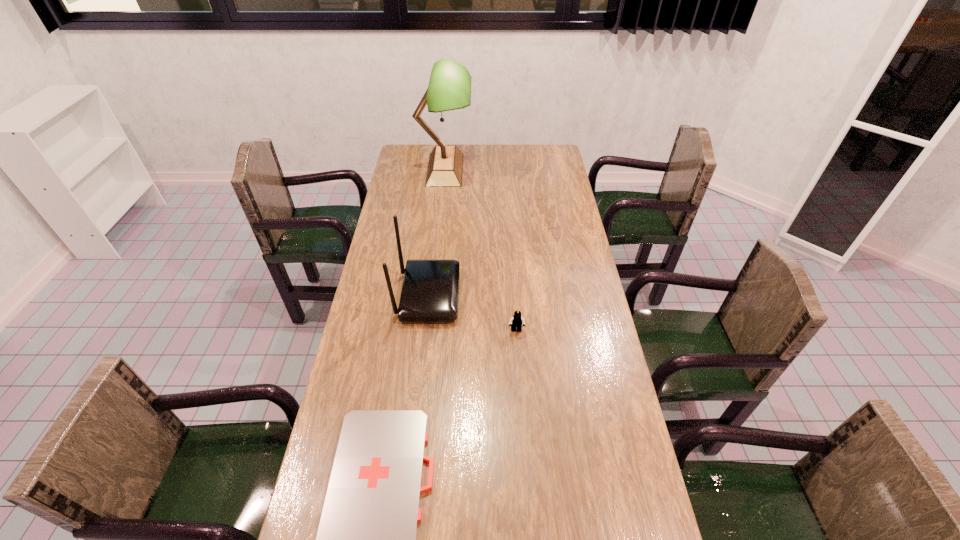
The image size is (960, 540). I want to click on table lamp that is at the left edge, so click(x=449, y=88).

Locate an element on the screen. This screenshot has height=540, width=960. router located in the left edge section of the desktop is located at coordinates (430, 290).

This screenshot has height=540, width=960. I want to click on object that is at the far left corner, so click(x=449, y=88).

What are the coordinates of `vacant space at the far edge` in the screenshot? It's located at (511, 147).

This screenshot has height=540, width=960. Find the location of `vacant area at the left edge`. vacant area at the left edge is located at coordinates (411, 200).

The image size is (960, 540). What are the coordinates of `free space at the right edge of the desktop` in the screenshot? It's located at (610, 423).

The image size is (960, 540). In the image, there is a desktop. Find the location of `blank space at the far left corner`. blank space at the far left corner is located at coordinates (420, 160).

In the image, there is a desktop. Identify the location of free space at the far right corner. (558, 154).

Locate an element on the screen. The width and height of the screenshot is (960, 540). free spot between the third shortest object and the tallest object is located at coordinates (437, 232).

You are a GUI agent. You are given a task and a screenshot of the screen. Output one action in this format:
    pyautogui.click(x=<x>, y=<y>)
    Task: Click on the vacant point located between the second tallest object and the third tallest object
    
    Given the screenshot: What is the action you would take?
    pyautogui.click(x=472, y=313)